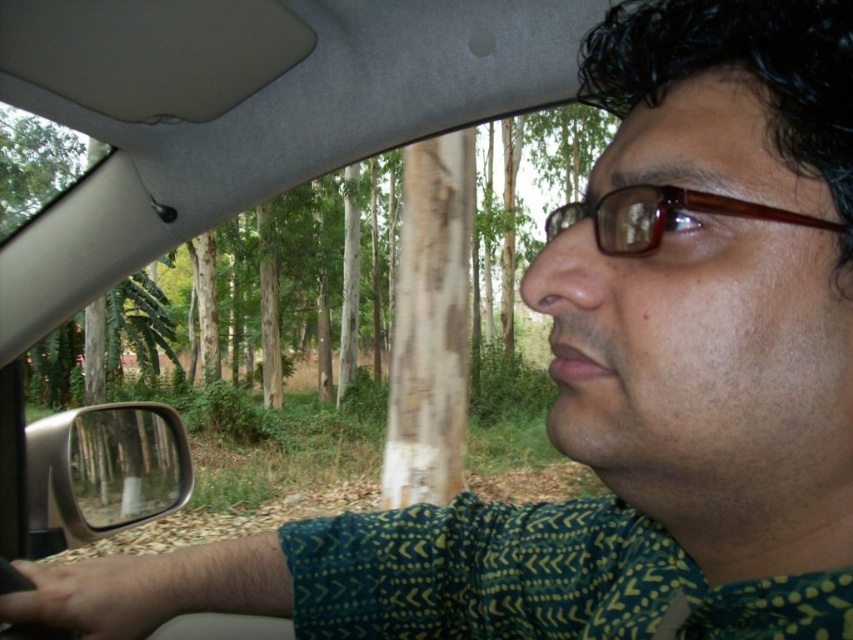
Can you confirm if clear plastic mirror at left is thinner than brown plastic glasses at upper center?

No, clear plastic mirror at left is not thinner than brown plastic glasses at upper center.

Is clear plastic mirror at left shorter than brown plastic glasses at upper center?

In fact, clear plastic mirror at left may be taller than brown plastic glasses at upper center.

Image resolution: width=853 pixels, height=640 pixels. What do you see at coordinates (120, 467) in the screenshot?
I see `clear plastic mirror at left` at bounding box center [120, 467].

Where is `clear plastic mirror at left`? Image resolution: width=853 pixels, height=640 pixels. clear plastic mirror at left is located at coordinates (120, 467).